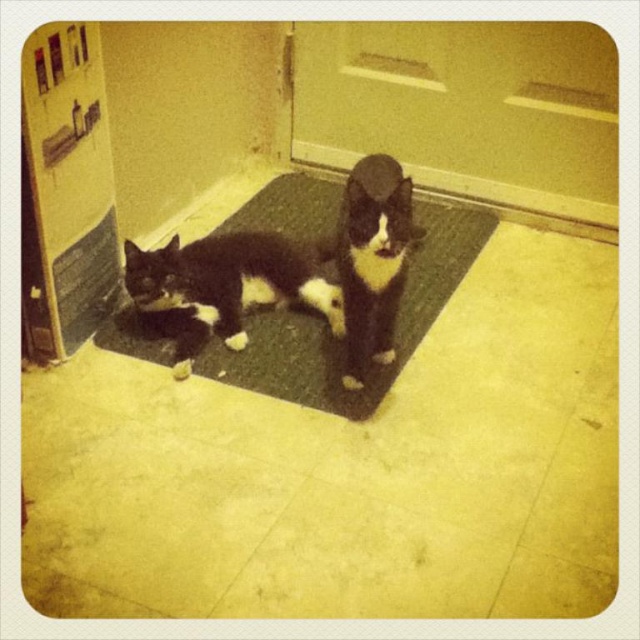
Question: Which point is farther from the camera taking this photo?

Choices:
 (A) (54, 147)
 (B) (316, 225)

Answer: (B)

Question: Is wooden door at left above black rubber doormat at center?

Choices:
 (A) no
 (B) yes

Answer: (B)

Question: Is black rubber doormat at center positioned behind black and white fur cat at center?

Choices:
 (A) yes
 (B) no

Answer: (A)

Question: Which is nearer to the black fur cat at center?

Choices:
 (A) wooden door at left
 (B) black and white fur cat at center

Answer: (B)

Question: Which point is farther from the camera taking this photo?

Choices:
 (A) (406, 221)
 (B) (288, 195)

Answer: (B)

Question: Does black rubber doormat at center have a larger size compared to black and white fur cat at center?

Choices:
 (A) yes
 (B) no

Answer: (A)